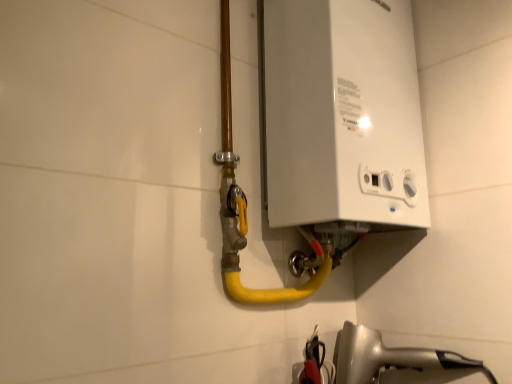
The width and height of the screenshot is (512, 384). Describe the element at coordinates (341, 113) in the screenshot. I see `white plastic boiler at upper right` at that location.

Where is `white plastic boiler at upper right`? This screenshot has height=384, width=512. white plastic boiler at upper right is located at coordinates (341, 113).

You are a GUI agent. You are given a task and a screenshot of the screen. Output one action in this format:
    pyautogui.click(x=<x>, y=<y>)
    Task: Click on the white glossy hairdryer at lower right
    The height and width of the screenshot is (384, 512).
    Given the screenshot: What is the action you would take?
    390,357

In order to face white glossy hairdryer at lower right, should I rotate leftwards or rightwards?

A 18.929 degree turn to the right will do.

The height and width of the screenshot is (384, 512). What do you see at coordinates (390, 357) in the screenshot?
I see `white glossy hairdryer at lower right` at bounding box center [390, 357].

Locate an element on the screen. The height and width of the screenshot is (384, 512). white plastic boiler at upper right is located at coordinates (341, 113).

Between white plastic boiler at upper right and white glossy hairdryer at lower right, which one appears on the right side from the viewer's perspective?

white glossy hairdryer at lower right is more to the right.

Is white plastic boiler at upper right positioned before white glossy hairdryer at lower right?

Yes, white plastic boiler at upper right is closer to the viewer.

Is point (408, 23) more distant than point (345, 330)?

Yes, point (408, 23) is farther from viewer.

From the image's perspective, which is above, white plastic boiler at upper right or white glossy hairdryer at lower right?

white plastic boiler at upper right is shown above in the image.

From a real-world perspective, is white plastic boiler at upper right on top of white glossy hairdryer at lower right?

Yes, from a real-world perspective, white plastic boiler at upper right is over white glossy hairdryer at lower right

Does white plastic boiler at upper right have a greater width compared to white glossy hairdryer at lower right?

No.

Between white plastic boiler at upper right and white glossy hairdryer at lower right, which one has less height?

white glossy hairdryer at lower right.

Can you confirm if white plastic boiler at upper right is smaller than white glossy hairdryer at lower right?

No.

Is white plastic boiler at upper right not within white glossy hairdryer at lower right?

Yes, white plastic boiler at upper right is outside of white glossy hairdryer at lower right.

Are white plastic boiler at upper right and white glossy hairdryer at lower right beside each other?

No, white plastic boiler at upper right is not in contact with white glossy hairdryer at lower right.

Is white plastic boiler at upper right positioned with its back to white glossy hairdryer at lower right?

white plastic boiler at upper right is not turned away from white glossy hairdryer at lower right.

What's the angular difference between white plastic boiler at upper right and white glossy hairdryer at lower right's facing directions?

The facing directions of white plastic boiler at upper right and white glossy hairdryer at lower right are 5.85 degrees apart.

How much distance is there between white plastic boiler at upper right and white glossy hairdryer at lower right?

18.24 inches.

Where is `appliance above the white glossy hairdryer at lower right (from the image's perspective)`? appliance above the white glossy hairdryer at lower right (from the image's perspective) is located at coordinates (341, 113).

Does white glossy hairdryer at lower right appear on the right side of white plastic boiler at upper right?

Yes, white glossy hairdryer at lower right is to the right of white plastic boiler at upper right.

In the scene shown: Considering the relative positions of white glossy hairdryer at lower right and white plastic boiler at upper right in the image provided, is white glossy hairdryer at lower right behind white plastic boiler at upper right?

Yes, it is.

Is point (380, 357) in front of point (378, 119)?

No, it is not.

From the image's perspective, is white glossy hairdryer at lower right located above or below white plastic boiler at upper right?

white glossy hairdryer at lower right is below white plastic boiler at upper right.

From a real-world perspective, is white glossy hairdryer at lower right positioned above or below white plastic boiler at upper right?

In terms of real-world spatial position, white glossy hairdryer at lower right is below white plastic boiler at upper right.

Considering the relative sizes of white glossy hairdryer at lower right and white plastic boiler at upper right in the image provided, is white glossy hairdryer at lower right thinner than white plastic boiler at upper right?

No.

Can you confirm if white glossy hairdryer at lower right is taller than white plastic boiler at upper right?

No, white glossy hairdryer at lower right is not taller than white plastic boiler at upper right.

In the scene shown: Is white glossy hairdryer at lower right smaller than white plastic boiler at upper right?

Indeed, white glossy hairdryer at lower right has a smaller size compared to white plastic boiler at upper right.

Is white glossy hairdryer at lower right outside of white plastic boiler at upper right?

Absolutely, white glossy hairdryer at lower right is external to white plastic boiler at upper right.

Is white glossy hairdryer at lower right next to white plastic boiler at upper right?

white glossy hairdryer at lower right is not next to white plastic boiler at upper right, and they're not touching.

Is white glossy hairdryer at lower right oriented away from white plastic boiler at upper right?

No, white glossy hairdryer at lower right is not facing the opposite direction of white plastic boiler at upper right.

How far apart are white glossy hairdryer at lower right and white plastic boiler at upper right?

white glossy hairdryer at lower right is 18.24 inches from white plastic boiler at upper right.

The width and height of the screenshot is (512, 384). Identify the location of appliance on the left of white glossy hairdryer at lower right. (341, 113).

The width and height of the screenshot is (512, 384). What are the coordinates of `appliance located on the left of white glossy hairdryer at lower right` in the screenshot? It's located at (341, 113).

You are a GUI agent. You are given a task and a screenshot of the screen. Output one action in this format:
    pyautogui.click(x=<x>, y=<y>)
    Task: Click on the appliance above the white glossy hairdryer at lower right (from the image's perspective)
    
    Given the screenshot: What is the action you would take?
    pyautogui.click(x=341, y=113)